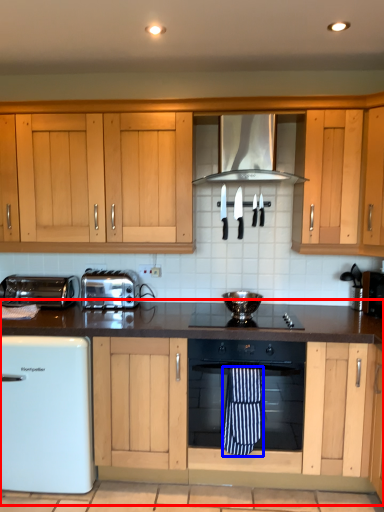
Question: Which of the following is the farthest to the observer, countertop (highlighted by a red box) or beach towel (highlighted by a blue box)?

Choices:
 (A) countertop
 (B) beach towel

Answer: (B)